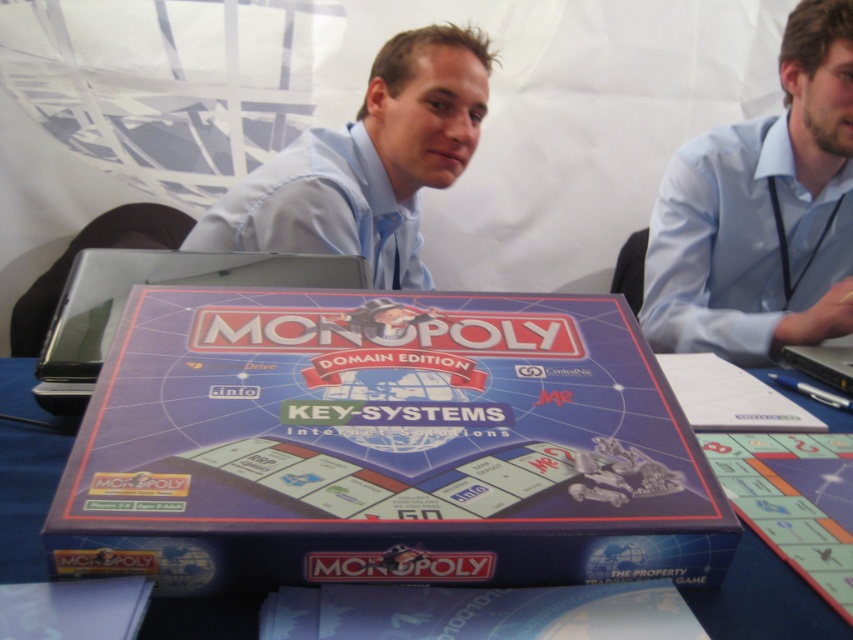
You are a photographer setting up a shot of the Monopoly game. You notice the light blue shirt at center and the silver metallic laptop at center. Which object is taller in the image?

The light blue shirt at center is taller than the silver metallic laptop at center.

You are a photographer trying to capture the Monopoly board game box in the image. You want to focus on the two points labeled as point (x=189, y=637) and point (x=352, y=268). Which point should you focus on first to ensure it appears clearer in the photo?

Point (x=189, y=637) is closer to the camera than point (x=352, y=268), so focusing on point (x=189, y=637) first will ensure it appears clearer in the photo.